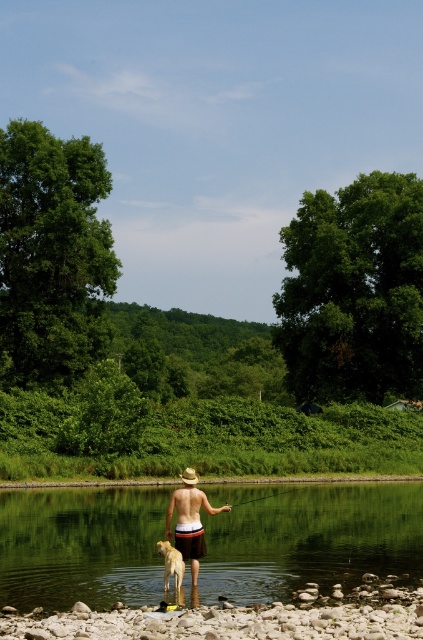
You are standing on the smooth sand shore at lower center and want to reach the tan straw hat at center. Which direction should you move to get there?

The smooth sand shore at lower center is positioned on the right side of tan straw hat at center. To reach the tan straw hat at center, you should move to the left.

You are a photographer planning to take a picture of the smooth sand shore at lower center and the golden fur dog at lower center. Since you want both subjects to be in focus, which one should you position closer to the camera to ensure depth of field?

The smooth sand shore at lower center is further to the viewer than the golden fur dog at lower center, so to ensure both are in focus, you should position the golden fur dog at lower center closer to the camera.